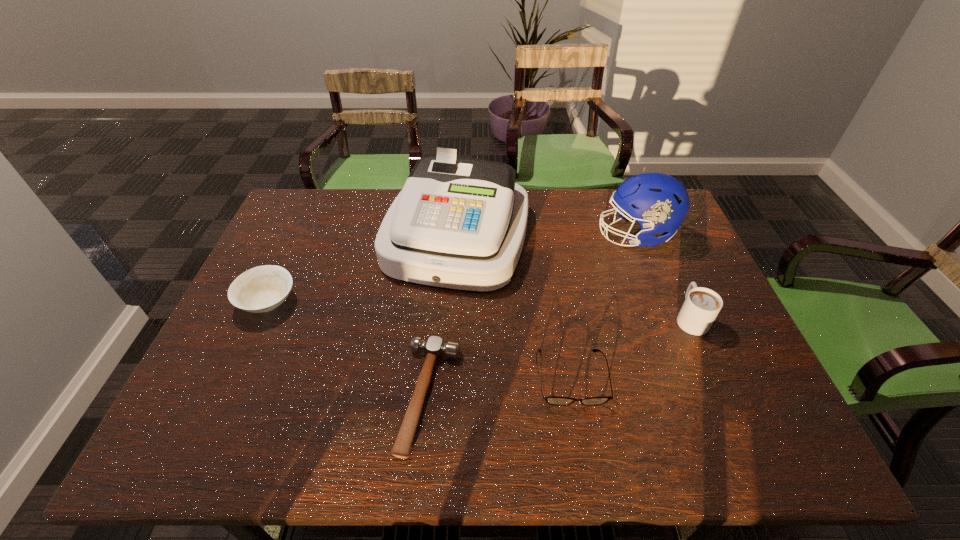
Identify the location of free space between the hammer and the spectacles. The width and height of the screenshot is (960, 540). (500, 387).

Where is `free space between the cappuccino and the leftmost object`? This screenshot has height=540, width=960. free space between the cappuccino and the leftmost object is located at coordinates (479, 310).

Find the location of `vacant area between the hammer and the cappuccino`. vacant area between the hammer and the cappuccino is located at coordinates (560, 357).

The image size is (960, 540). In order to click on vacant space that is in between the hammer and the cash register in this screenshot , I will do `click(444, 316)`.

What are the coordinates of `vacant point located between the cash register and the spectacles` in the screenshot? It's located at (514, 307).

Identify the location of free area in between the football helmet and the cappuccino. (663, 276).

The image size is (960, 540). In order to click on free space between the cappuccino and the football helmet in this screenshot , I will do click(663, 276).

The image size is (960, 540). What are the coordinates of `vacant space that is in between the hammer and the leftmost object` in the screenshot? It's located at (348, 349).

Identify the location of free space between the cappuccino and the spectacles. (631, 348).

Identify which object is the nearest to the hammer. Please provide its 2D coordinates. Your answer should be formatted as a tuple, i.e. [(x, y)], where the tuple contains the x and y coordinates of a point satisfying the conditions above.

[(459, 223)]